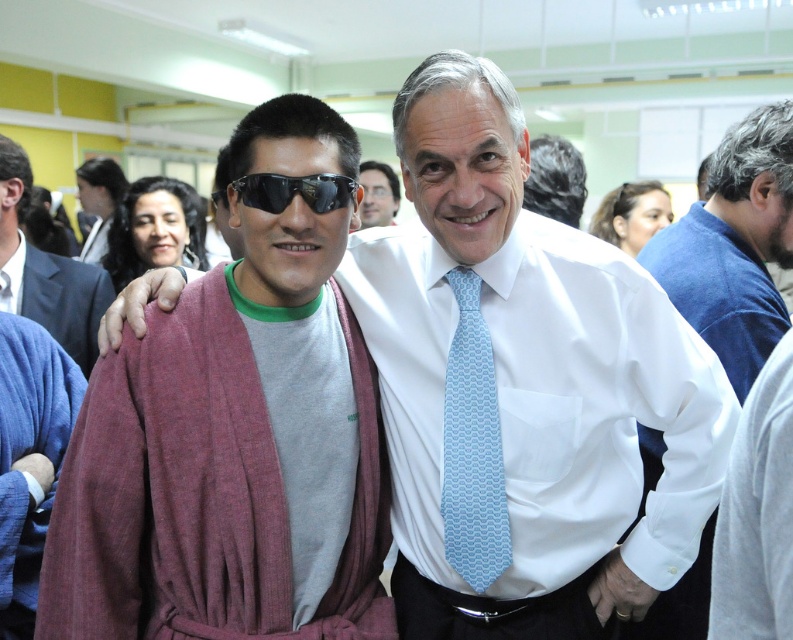
Looking at this image, does white shirt at center have a larger size compared to gray wool robe at center?

Yes.

Which is above, white shirt at center or gray wool robe at center?

Positioned higher is gray wool robe at center.

The width and height of the screenshot is (793, 640). What do you see at coordinates (734, 244) in the screenshot?
I see `white shirt at center` at bounding box center [734, 244].

Where is `white shirt at center`? The width and height of the screenshot is (793, 640). white shirt at center is located at coordinates (734, 244).

Between light blue woven tie at center and white silk shirt at center, which one has more height?

Standing taller between the two is light blue woven tie at center.

Can you confirm if light blue woven tie at center is positioned to the right of white silk shirt at center?

In fact, light blue woven tie at center is to the left of white silk shirt at center.

The image size is (793, 640). Identify the location of light blue woven tie at center. (472, 445).

Between maroon textured robe at center and matte black sunglasses at upper center, which one has less height?

matte black sunglasses at upper center is shorter.

Is maroon textured robe at center positioned at the back of matte black sunglasses at upper center?

No, maroon textured robe at center is in front of matte black sunglasses at upper center.

Find the location of a particular element. This screenshot has width=793, height=640. maroon textured robe at center is located at coordinates (29, 456).